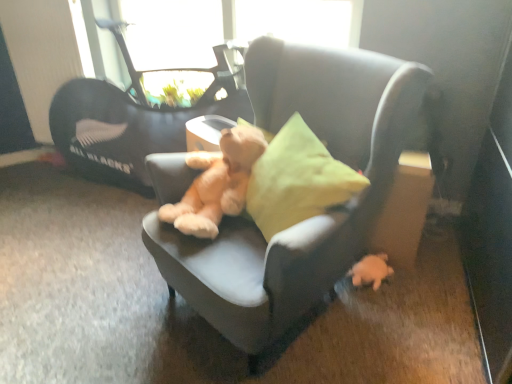
You are a GUI agent. You are given a task and a screenshot of the screen. Output one action in this format:
    pyautogui.click(x=<x>, y=<y>)
    Task: Click on the vacant region to the left of soft gray chair at center
    The height and width of the screenshot is (384, 512).
    Given the screenshot: What is the action you would take?
    pyautogui.click(x=90, y=299)